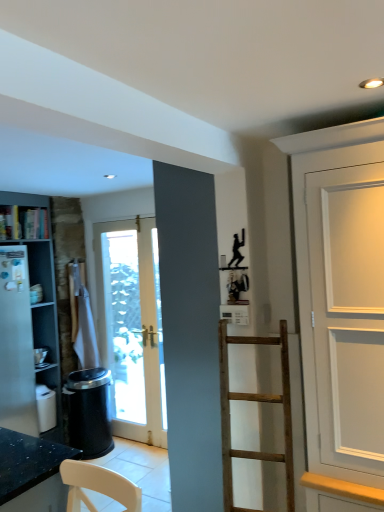
Question: Can you confirm if white matte cabinet at left is thinner than wooden bookshelf at left?

Choices:
 (A) yes
 (B) no

Answer: (B)

Question: From a real-world perspective, is white matte cabinet at left below wooden bookshelf at left?

Choices:
 (A) yes
 (B) no

Answer: (A)

Question: Is white matte cabinet at left wider than wooden bookshelf at left?

Choices:
 (A) yes
 (B) no

Answer: (A)

Question: Is white matte cabinet at left aimed at wooden bookshelf at left?

Choices:
 (A) no
 (B) yes

Answer: (B)

Question: Is white matte cabinet at left positioned with its back to wooden bookshelf at left?

Choices:
 (A) yes
 (B) no

Answer: (B)

Question: Can you confirm if white matte cabinet at left is shorter than wooden bookshelf at left?

Choices:
 (A) no
 (B) yes

Answer: (A)

Question: Can you confirm if wooden bookshelf at left is taller than white matte cabinet at left?

Choices:
 (A) no
 (B) yes

Answer: (A)

Question: Is wooden bookshelf at left wider than white matte cabinet at left?

Choices:
 (A) yes
 (B) no

Answer: (B)

Question: Does wooden bookshelf at left have a lesser height compared to white matte cabinet at left?

Choices:
 (A) yes
 (B) no

Answer: (A)

Question: From the image's perspective, does wooden bookshelf at left appear lower than white matte cabinet at left?

Choices:
 (A) no
 (B) yes

Answer: (A)

Question: Can you confirm if wooden bookshelf at left is bigger than white matte cabinet at left?

Choices:
 (A) yes
 (B) no

Answer: (B)

Question: Is wooden bookshelf at left further to camera compared to white matte cabinet at left?

Choices:
 (A) yes
 (B) no

Answer: (A)

Question: Looking at their shapes, would you say white matte cabinet at left is wider or thinner than wooden bookshelf at left?

Choices:
 (A) thin
 (B) wide

Answer: (B)